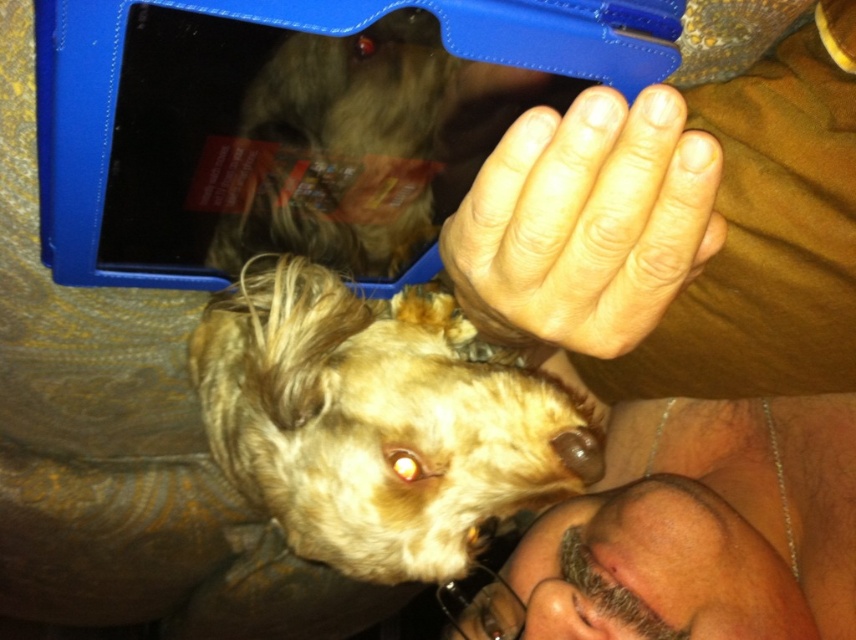
Question: Does fuzzy brown dog at upper center have a smaller size compared to brown matte nose at center?

Choices:
 (A) no
 (B) yes

Answer: (A)

Question: Which point is farther from the camera taking this photo?

Choices:
 (A) (586, 593)
 (B) (247, 401)
 (C) (384, 227)

Answer: (A)

Question: Considering the relative positions of fuzzy brown dog at upper center and brown matte nose at center in the image provided, where is fuzzy brown dog at upper center located with respect to brown matte nose at center?

Choices:
 (A) below
 (B) above

Answer: (B)

Question: Does fuzzy golden dog at center come in front of fuzzy brown dog at upper center?

Choices:
 (A) no
 (B) yes

Answer: (A)

Question: Based on their relative distances, which object is nearer to the fuzzy golden dog at center?

Choices:
 (A) fuzzy brown dog at upper center
 (B) brown matte nose at center

Answer: (A)

Question: Which object appears closest to the camera in this image?

Choices:
 (A) brown matte nose at center
 (B) fuzzy brown dog at upper center
 (C) fuzzy golden dog at center

Answer: (B)